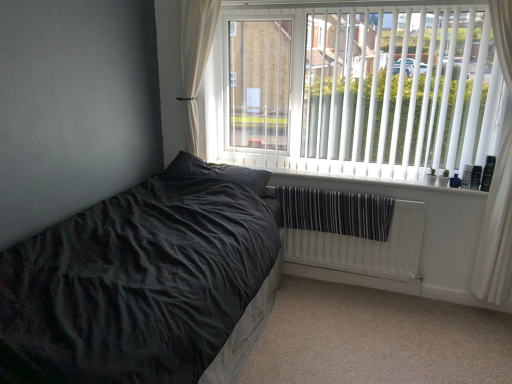
Question: Would you say white textured radiator at lower right is inside or outside white sheer curtain at upper left, the 2th curtain viewed from the right?

Choices:
 (A) outside
 (B) inside

Answer: (A)

Question: Considering the positions of white textured radiator at lower right and white sheer curtain at upper left, the 2th curtain viewed from the right, in the image, is white textured radiator at lower right wider or thinner than white sheer curtain at upper left, the 2th curtain viewed from the right,?

Choices:
 (A) wide
 (B) thin

Answer: (B)

Question: Estimate the real-world distances between objects in this image. Which object is closer to the white textured radiator at lower right?

Choices:
 (A) white plastic radiator at lower center
 (B) velvet black bed at lower left
 (C) white sheer curtain at right, marked as the first curtain in a right-to-left arrangement
 (D) white vertical blinds at upper right
 (E) white sheer curtain at upper left, the 2th curtain viewed from the right

Answer: (A)

Question: Which is nearer to the white sheer curtain at right, the 2th curtain positioned from the left?

Choices:
 (A) white vertical blinds at upper right
 (B) white textured radiator at lower right
 (C) velvet black bed at lower left
 (D) white plastic radiator at lower center
 (E) white sheer curtain at upper left, the 2th curtain viewed from the right

Answer: (D)